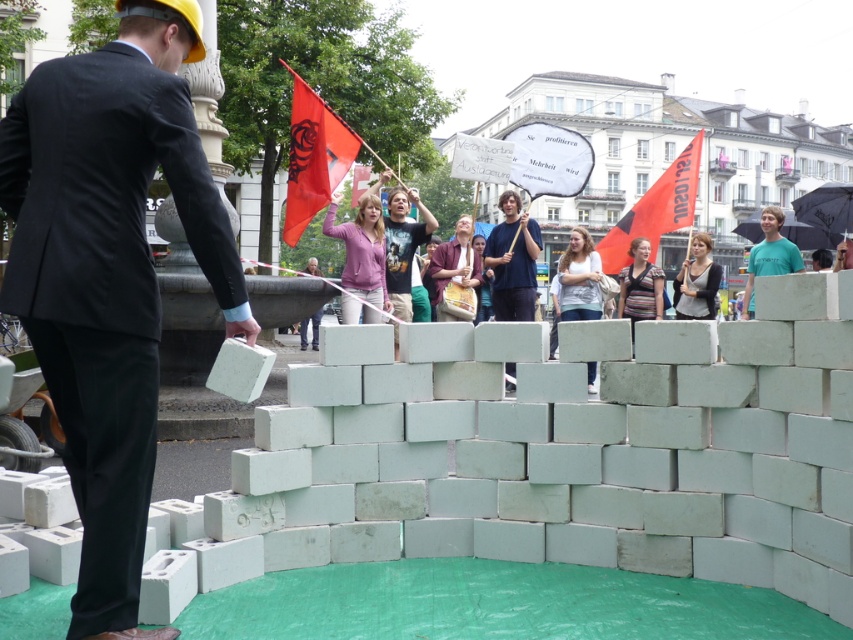
Who is higher up, red fabric flag at upper center or black fabric shirt at center?

red fabric flag at upper center is higher up.

In the scene shown: Can you confirm if red fabric flag at upper center is wider than black fabric shirt at center?

No, red fabric flag at upper center is not wider than black fabric shirt at center.

Which is behind, point (293, 152) or point (700, 288)?

The point (293, 152) is more distant.

This screenshot has height=640, width=853. In order to click on red fabric flag at upper center in this screenshot , I will do `click(312, 156)`.

Looking at this image, can you confirm if matte black suit at center is positioned to the right of orange fabric flag at upper right?

No, matte black suit at center is not to the right of orange fabric flag at upper right.

Does point (70, 269) come farther from viewer compared to point (666, 204)?

No, (70, 269) is in front of (666, 204).

Describe the element at coordinates (109, 273) in the screenshot. I see `matte black suit at center` at that location.

At what (x,y) coordinates should I click in order to perform the action: click on matte black suit at center. Please return your answer as a coordinate pair (x, y). This screenshot has height=640, width=853. Looking at the image, I should click on (109, 273).

Is matte black suit at center below red fabric flag at upper center?

Yes.

Is the position of matte black suit at center more distant than that of red fabric flag at upper center?

No, it is not.

You are a GUI agent. You are given a task and a screenshot of the screen. Output one action in this format:
    pyautogui.click(x=<x>, y=<y>)
    Task: Click on the matte black suit at center
    The image size is (853, 640).
    Given the screenshot: What is the action you would take?
    pyautogui.click(x=109, y=273)

Find the location of `matte black suit at center`. matte black suit at center is located at coordinates (109, 273).